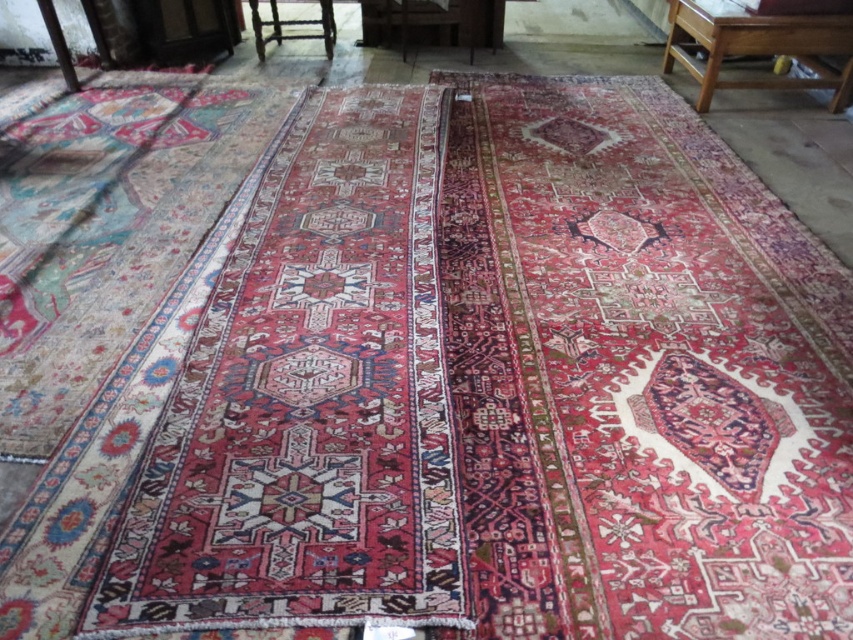
You are an interior designer planning to place a large potted plant that requires a 1.2 meter wide space between the wooden table at upper right and wooden chair at upper center. Can the space accommodate the plant?

The wooden table at upper right is smaller than the wooden chair at upper center, but the exact dimensions of the space between them are not provided. Therefore, it is uncertain if the 1.2 meter requirement can be met.

You are standing at point (787, 35) and want to walk to the other side of the room. The two Persian rugs are placed 3.61 meters apart. If your walking path must avoid stepping on either rug, what is the minimum distance you need to walk around them?

The minimum distance you need to walk around the Persian rugs is 3.61 meters, as this is the distance between the two rugs, allowing you to navigate around them without stepping on either.

You are an interior designer planning to place a 1.2 meter wide sofa between the wooden chair at upper center and the wooden chair at center. Given their widths, will the sofa fit between them?

The wooden chair at upper center is wider than the wooden chair at center. Since the sofa is 1.2 meters wide, the space between them must be at least 1.2 meters. However, the description only states the relative widths of the chairs, not the distance between them. Therefore, we cannot determine if the sofa will fit based on the provided information.